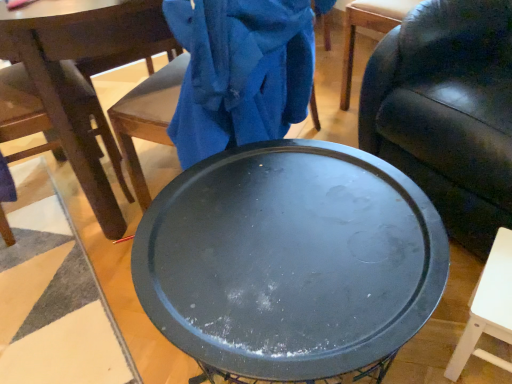
Question: Is black matte round table at center positioned before dark brown wood chair at left, which is the second chair from right to left?

Choices:
 (A) no
 (B) yes

Answer: (B)

Question: Does black matte round table at center come behind dark brown wood chair at left, which is the second chair from right to left?

Choices:
 (A) yes
 (B) no

Answer: (B)

Question: From the image's perspective, would you say black matte round table at center is positioned over dark brown wood chair at left, the 1th chair from the left?

Choices:
 (A) yes
 (B) no

Answer: (B)

Question: Considering the relative sizes of black matte round table at center and dark brown wood chair at left, the 1th chair from the left, in the image provided, is black matte round table at center thinner than dark brown wood chair at left, the 1th chair from the left,?

Choices:
 (A) yes
 (B) no

Answer: (B)

Question: Can you confirm if black matte round table at center is bigger than dark brown wood chair at left, the 1th chair from the left?

Choices:
 (A) no
 (B) yes

Answer: (A)

Question: Considering the relative positions of black matte round table at center and matte black tray at center in the image provided, is black matte round table at center to the left or to the right of matte black tray at center?

Choices:
 (A) right
 (B) left

Answer: (B)

Question: Is black matte round table at center inside or outside of matte black tray at center?

Choices:
 (A) inside
 (B) outside

Answer: (B)

Question: From a real-world perspective, relative to matte black tray at center, is black matte round table at center vertically above or below?

Choices:
 (A) below
 (B) above

Answer: (A)

Question: In terms of width, does black matte round table at center look wider or thinner when compared to matte black tray at center?

Choices:
 (A) thin
 (B) wide

Answer: (B)

Question: From their relative heights in the image, would you say leather couch at center, the 1th chair when ordered from right to left, is taller or shorter than matte black tray at center?

Choices:
 (A) short
 (B) tall

Answer: (B)

Question: From the image's perspective, is leather couch at center, the 2th chair when ordered from left to right, positioned above or below matte black tray at center?

Choices:
 (A) below
 (B) above

Answer: (B)

Question: Relative to matte black tray at center, is leather couch at center, the 1th chair when ordered from right to left, in front or behind?

Choices:
 (A) front
 (B) behind

Answer: (B)

Question: Would you say leather couch at center, the 1th chair when ordered from right to left, is inside or outside matte black tray at center?

Choices:
 (A) outside
 (B) inside

Answer: (A)

Question: Considering the positions of dark brown wood chair at left, which is the second chair from right to left, and leather couch at center, the 1th chair when ordered from right to left, in the image, is dark brown wood chair at left, which is the second chair from right to left, bigger or smaller than leather couch at center, the 1th chair when ordered from right to left,?

Choices:
 (A) big
 (B) small

Answer: (B)

Question: Does point (112, 233) appear closer or farther from the camera than point (498, 200)?

Choices:
 (A) farther
 (B) closer

Answer: (A)